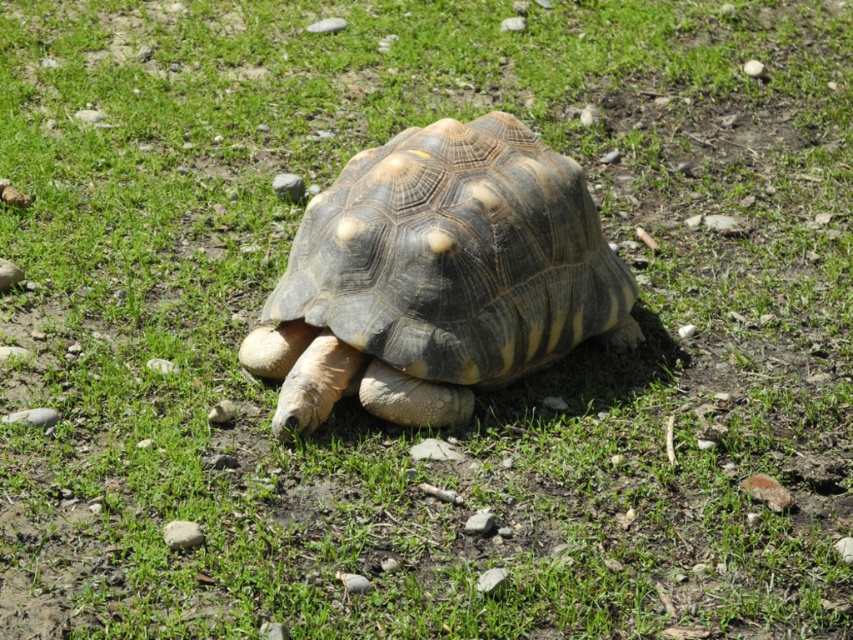
You are a wildlife photographer aiming to capture the leathery brown tortoise at center and the gray gravel stone at lower left in a single frame. Given their sizes, will the tortoise appear larger than the stone in the photo?

The leathery brown tortoise at center is taller than the gray gravel stone at lower left, so yes, the tortoise will appear larger than the stone in the photo.

You are a small insect trying to climb over the smooth gray rock at lower left and the gray gravel at lower left. Which one will be harder for you to climb?

The smooth gray rock at lower left is much taller than the gray gravel at lower left, so it will be harder to climb the smooth gray rock at lower left.